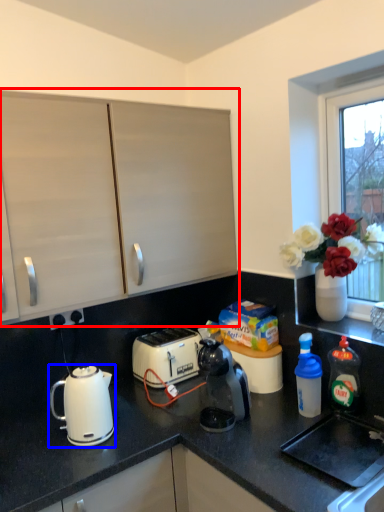
Question: Which object is closer to the camera taking this photo, cabinetry (highlighted by a red box) or kettle (highlighted by a blue box)?

Choices:
 (A) cabinetry
 (B) kettle

Answer: (A)